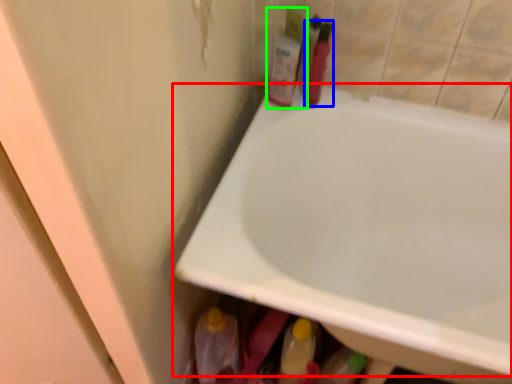
Question: Which is nearer to the bathtub (highlighted by a red box)? toiletry (highlighted by a blue box) or toiletry (highlighted by a green box).

Choices:
 (A) toiletry
 (B) toiletry

Answer: (B)